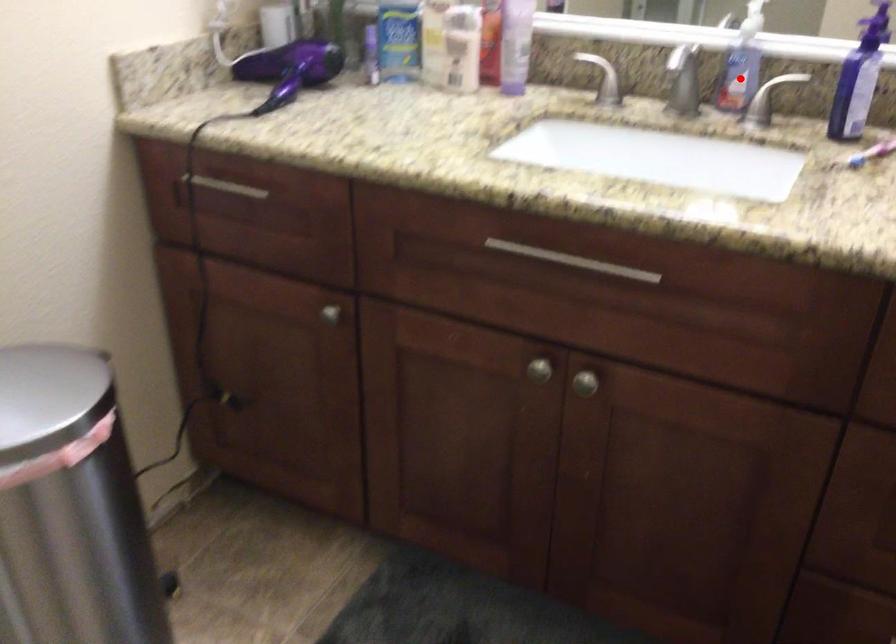
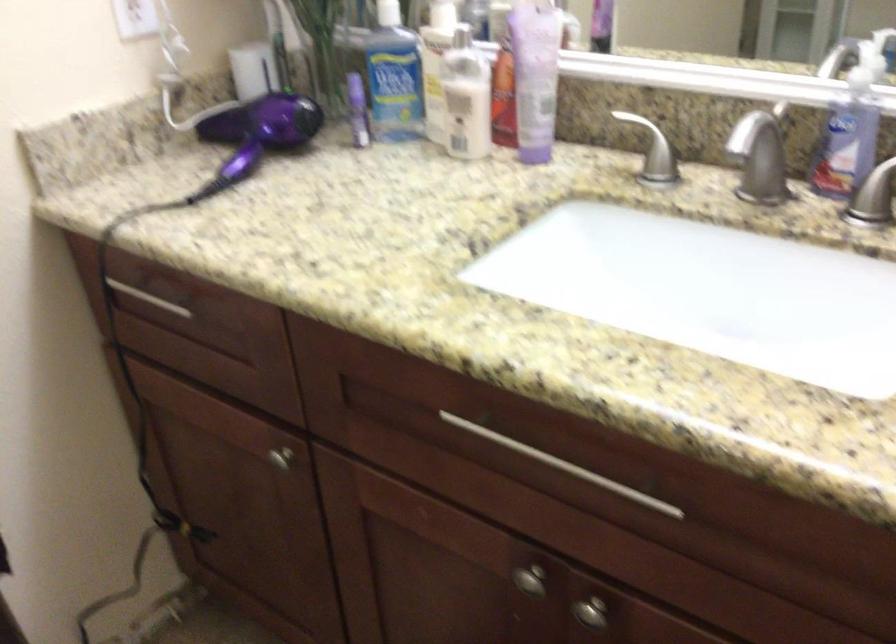
Where in the second image is the point corresponding to the highlighted location from the first image?

(846, 145)